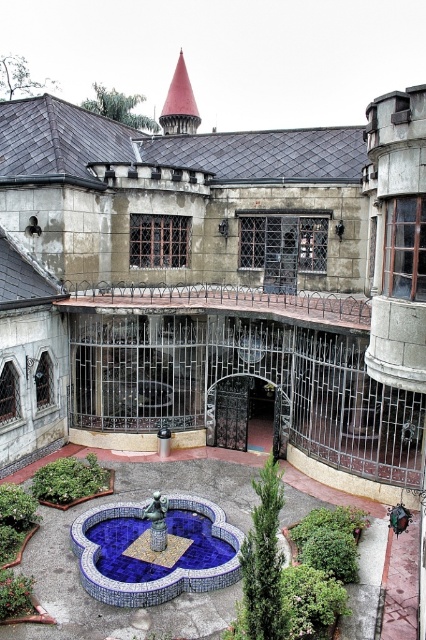
You are standing in the courtyard of a stone castle. You see a point marked at coordinates [215,280]. What object is located at that point?

The point at coordinates [215,280] corresponds to the stone castle at center.

In the scene shown: You are standing in the courtyard of a historic building and notice the blue mosaic fountain at center and the green leafy bush at center. From your vantage point, which object is positioned lower in the scene?

The blue mosaic fountain at center is positioned below the green leafy bush at center, so it is lower in the scene.